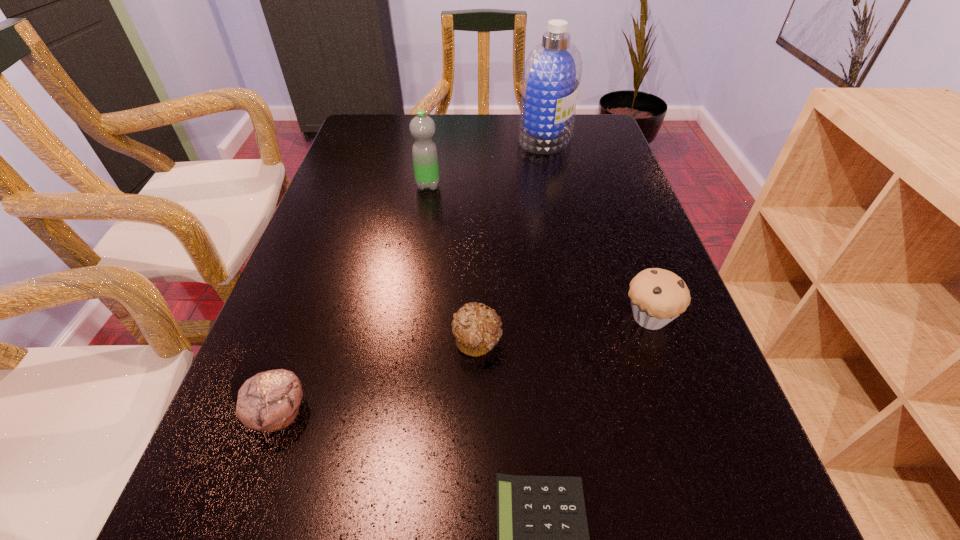
At what (x,y) coordinates should I click in order to perform the action: click on vacant space at the far edge of the desktop. Please return your answer as a coordinate pair (x, y). The width and height of the screenshot is (960, 540). Looking at the image, I should click on (455, 125).

The height and width of the screenshot is (540, 960). I want to click on blank space at the left edge of the desktop, so click(x=375, y=221).

Where is `free location at the right edge of the desktop`? The width and height of the screenshot is (960, 540). free location at the right edge of the desktop is located at coordinates (592, 163).

Identify the location of empty location between the tallest object and the leftmost object. (412, 276).

Where is `free space that is in between the fifth object from right to left and the rightmost muffin`? This screenshot has width=960, height=540. free space that is in between the fifth object from right to left and the rightmost muffin is located at coordinates (539, 252).

This screenshot has width=960, height=540. What are the coordinates of `free spot between the fourth shortest object and the fifth tallest object` in the screenshot? It's located at (564, 329).

What are the coordinates of `vacant space in between the fourth shortest object and the shortest muffin` in the screenshot? It's located at (564, 329).

This screenshot has height=540, width=960. Find the location of `free space between the leftmost muffin and the rightmost muffin`. free space between the leftmost muffin and the rightmost muffin is located at coordinates (464, 366).

Identify the location of vacant space that is in between the second tallest muffin and the third tallest object. This screenshot has height=540, width=960. (464, 366).

Image resolution: width=960 pixels, height=540 pixels. What are the coordinates of `vacant area that lies between the second muffin from right to left and the water bottle` in the screenshot? It's located at click(x=452, y=263).